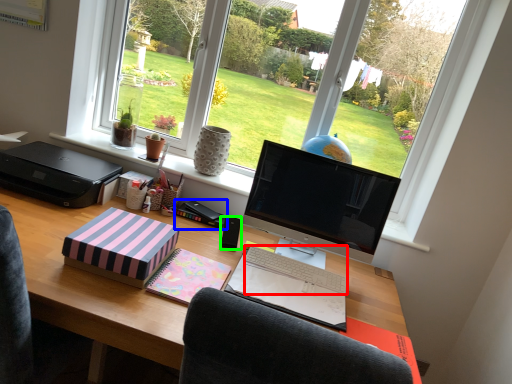
Question: Which is farther away from computer keyboard (highlighted by a red box)? book (highlighted by a blue box) or speaker (highlighted by a green box)?

Choices:
 (A) book
 (B) speaker

Answer: (A)